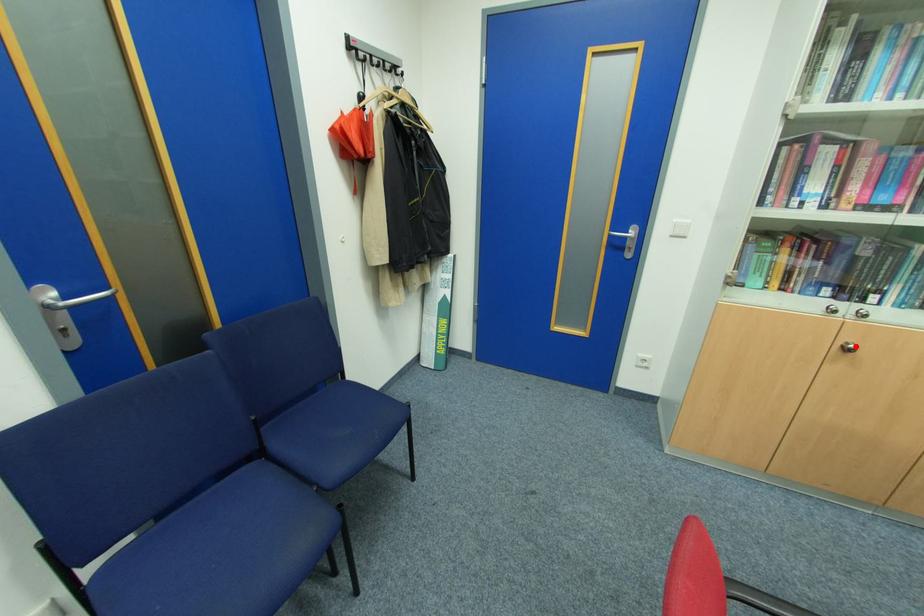
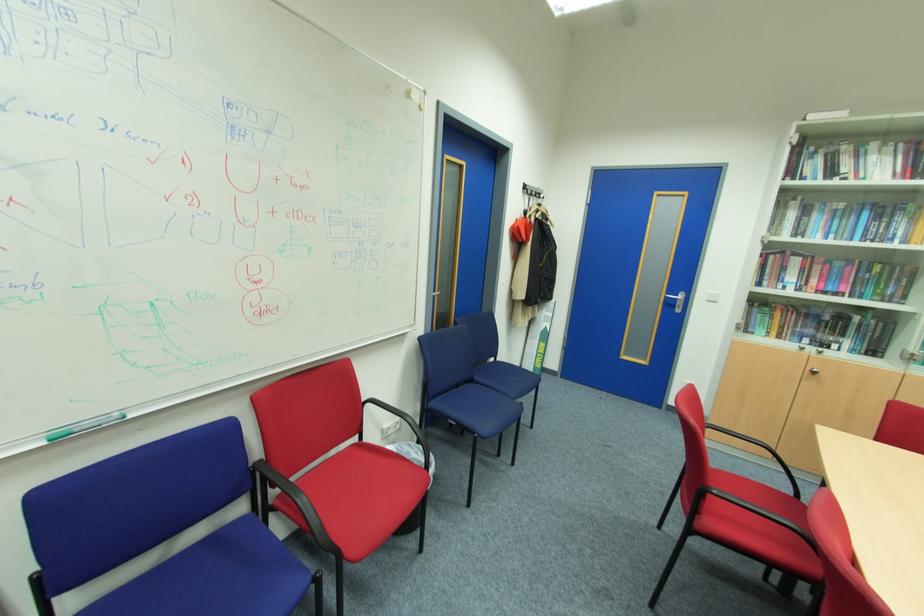
In the second image, find the point that corresponds to the highlighted location in the first image.

(820, 371)